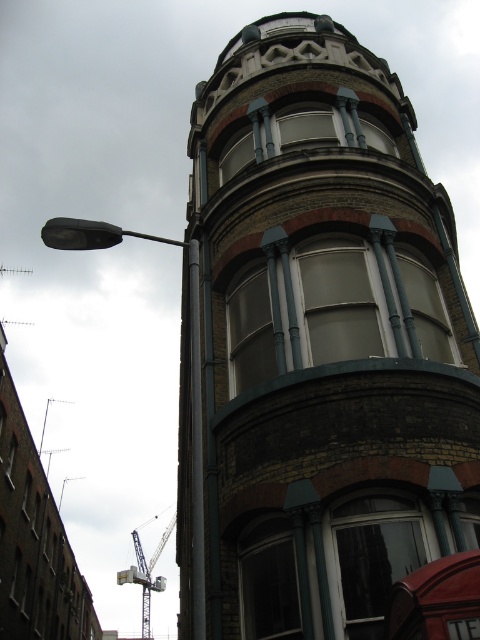
Question: Which point is closer to the camera?

Choices:
 (A) (350, 198)
 (B) (143, 612)
 (C) (109, 230)

Answer: (C)

Question: Does brown brick tower at upper center appear on the right side of metallic gray crane at lower left?

Choices:
 (A) yes
 (B) no

Answer: (A)

Question: Among these objects, which one is nearest to the camera?

Choices:
 (A) brown brick tower at upper center
 (B) metallic gray crane at lower left

Answer: (A)

Question: Is black metal streetlight at left to the right of metallic gray crane at lower left from the viewer's perspective?

Choices:
 (A) yes
 (B) no

Answer: (A)

Question: Does brown brick tower at upper center appear on the left side of metallic gray crane at lower left?

Choices:
 (A) yes
 (B) no

Answer: (B)

Question: Among these points, which one is nearest to the camera?

Choices:
 (A) (194, 404)
 (B) (148, 572)
 (C) (243, 346)

Answer: (A)